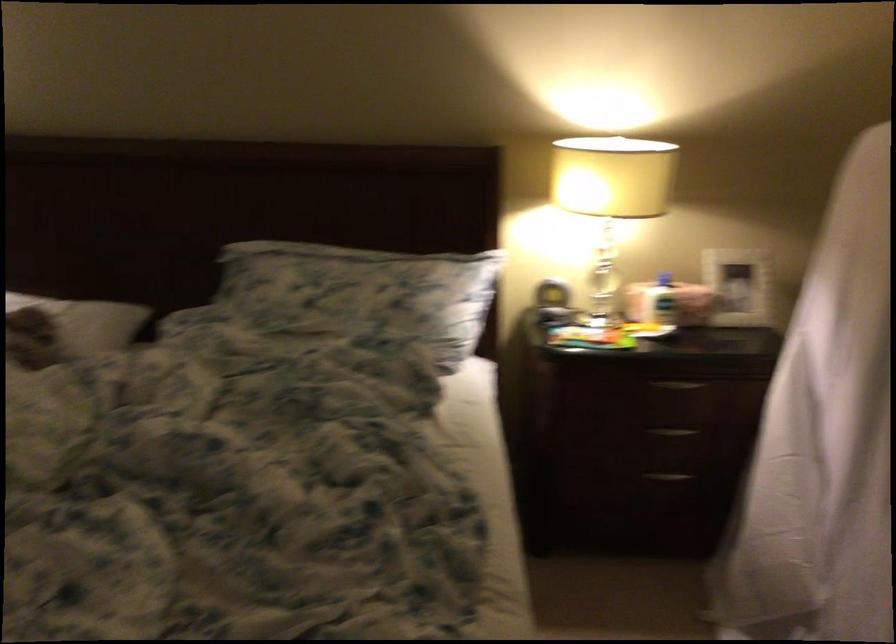
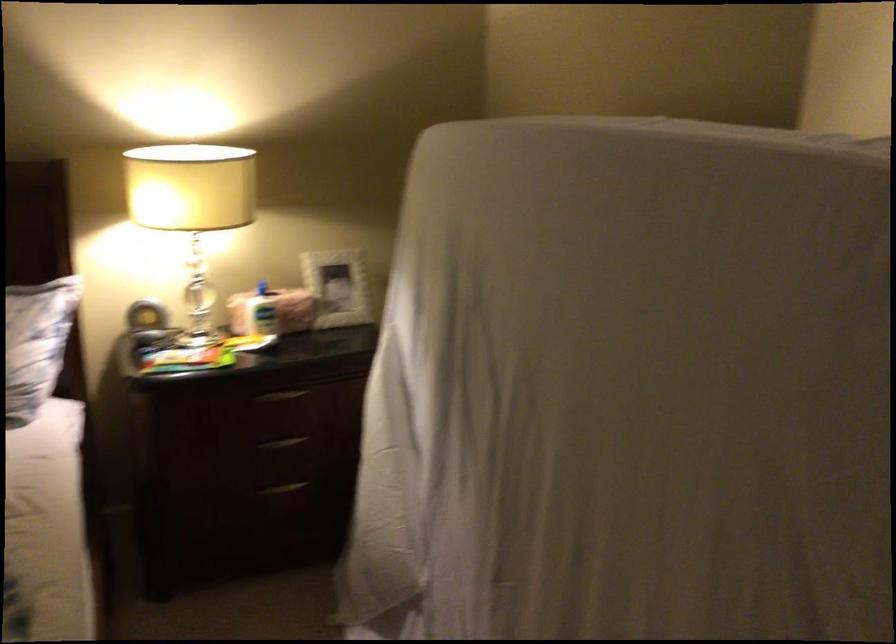
Find the pixel in the second image that matches (x=668, y=474) in the first image.

(283, 488)